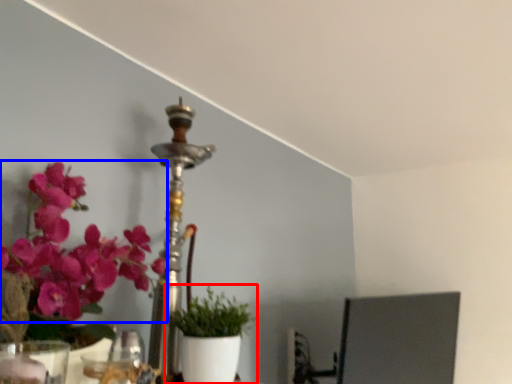
Question: Among these objects, which one is nearest to the camera, houseplant (highlighted by a red box) or flower (highlighted by a blue box)?

Choices:
 (A) houseplant
 (B) flower

Answer: (B)